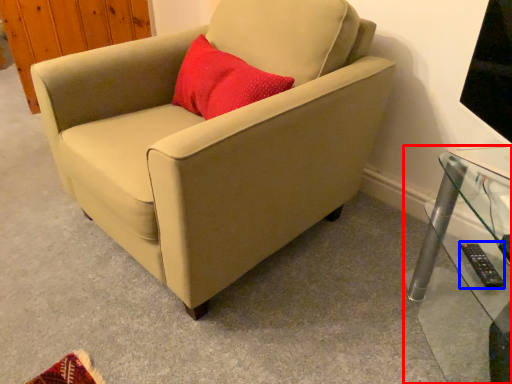
Question: Which object appears farthest to the camera in this image, table (highlighted by a red box) or remote (highlighted by a blue box)?

Choices:
 (A) table
 (B) remote

Answer: (B)